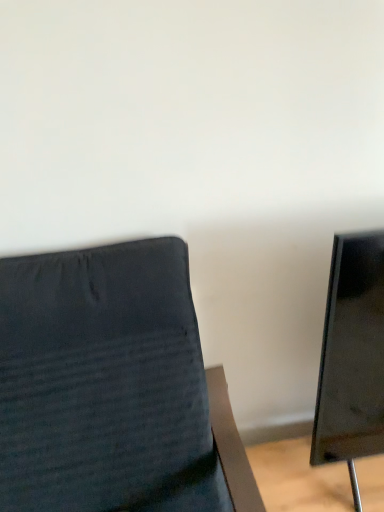
Question: Should I look upward or downward to see dark fabric chair at left?

Choices:
 (A) down
 (B) up

Answer: (A)